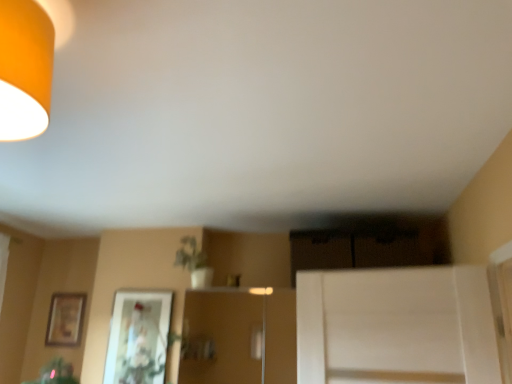
Question: Is green matte plant at center touching matte glass picture frame at center, the 1th picture frame positioned from the front?

Choices:
 (A) no
 (B) yes

Answer: (A)

Question: Does green matte plant at center appear on the right side of matte glass picture frame at center, the 1th picture frame positioned from the front?

Choices:
 (A) yes
 (B) no

Answer: (A)

Question: From a real-world perspective, is green matte plant at center physically below matte glass picture frame at center, which is the 2th picture frame in left-to-right order?

Choices:
 (A) yes
 (B) no

Answer: (B)

Question: Is green matte plant at center positioned with its back to matte glass picture frame at center, which is the 2th picture frame in left-to-right order?

Choices:
 (A) yes
 (B) no

Answer: (B)

Question: From a real-world perspective, is green matte plant at center located higher than matte glass picture frame at center, positioned as the second picture frame in back-to-front order?

Choices:
 (A) no
 (B) yes

Answer: (B)

Question: Is matte glass picture frame at center, positioned as the second picture frame in back-to-front order, spatially inside wooden framed picture at left, marked as the 2th picture frame in a front-to-back arrangement, or outside of it?

Choices:
 (A) outside
 (B) inside

Answer: (A)

Question: Considering the positions of matte glass picture frame at center, which is the 2th picture frame in left-to-right order, and wooden framed picture at left, which ranks as the 1th picture frame in left-to-right order, in the image, is matte glass picture frame at center, which is the 2th picture frame in left-to-right order, bigger or smaller than wooden framed picture at left, which ranks as the 1th picture frame in left-to-right order,?

Choices:
 (A) big
 (B) small

Answer: (A)

Question: In terms of width, does matte glass picture frame at center, positioned as the second picture frame in back-to-front order, look wider or thinner when compared to wooden framed picture at left, the second picture frame when ordered from right to left?

Choices:
 (A) thin
 (B) wide

Answer: (B)

Question: From a real-world perspective, is matte glass picture frame at center, the 1th picture frame positioned from the front, above or below wooden framed picture at left, the second picture frame when ordered from right to left?

Choices:
 (A) below
 (B) above

Answer: (A)

Question: Looking at their shapes, would you say matte orange lampshade at upper left is wider or thinner than matte glass picture frame at center, acting as the 1th picture frame starting from the right?

Choices:
 (A) wide
 (B) thin

Answer: (A)

Question: In terms of height, does matte orange lampshade at upper left look taller or shorter compared to matte glass picture frame at center, the 1th picture frame positioned from the front?

Choices:
 (A) short
 (B) tall

Answer: (A)

Question: Relative to matte glass picture frame at center, which is the 2th picture frame in left-to-right order, is matte orange lampshade at upper left in front or behind?

Choices:
 (A) behind
 (B) front

Answer: (B)

Question: Is point coord(16,33) positioned closer to the camera than point coord(133,322)?

Choices:
 (A) farther
 (B) closer

Answer: (B)

Question: From the image's perspective, is green matte plant at center located above or below wooden framed picture at left, the second picture frame when ordered from right to left?

Choices:
 (A) above
 (B) below

Answer: (A)

Question: From their relative heights in the image, would you say green matte plant at center is taller or shorter than wooden framed picture at left, the second picture frame when ordered from right to left?

Choices:
 (A) short
 (B) tall

Answer: (A)